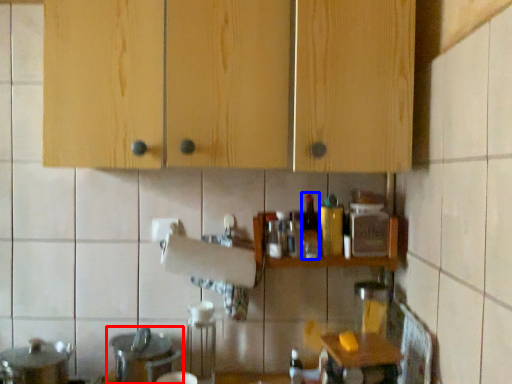
Question: Which of the following is the farthest to the observer, sink (highlighted by a red box) or bottle (highlighted by a blue box)?

Choices:
 (A) sink
 (B) bottle

Answer: (B)